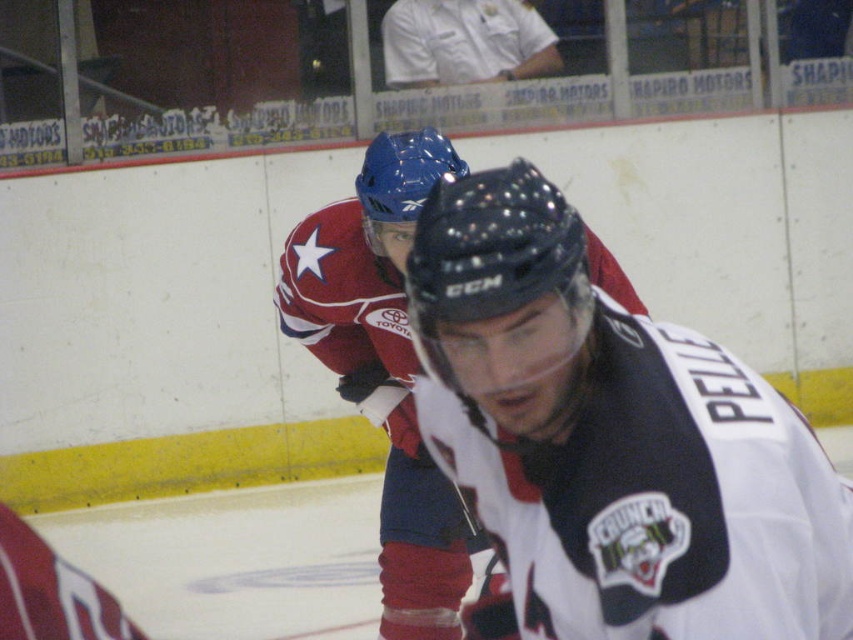
Question: Is white matte jersey at center in front of red jersey at center?

Choices:
 (A) yes
 (B) no

Answer: (A)

Question: Which object is the closest to the red jersey at center?

Choices:
 (A) white matte jersey at center
 (B) white cotton shirt at upper center

Answer: (A)

Question: Is red jersey at center below white cotton shirt at upper center?

Choices:
 (A) no
 (B) yes

Answer: (B)

Question: Which object is the closest to the white cotton shirt at upper center?

Choices:
 (A) red jersey at center
 (B) white matte jersey at center

Answer: (A)

Question: Which object is closer to the camera taking this photo?

Choices:
 (A) white cotton shirt at upper center
 (B) white matte jersey at center
 (C) red jersey at center

Answer: (B)

Question: Is white matte jersey at center closer to camera compared to red jersey at center?

Choices:
 (A) no
 (B) yes

Answer: (B)